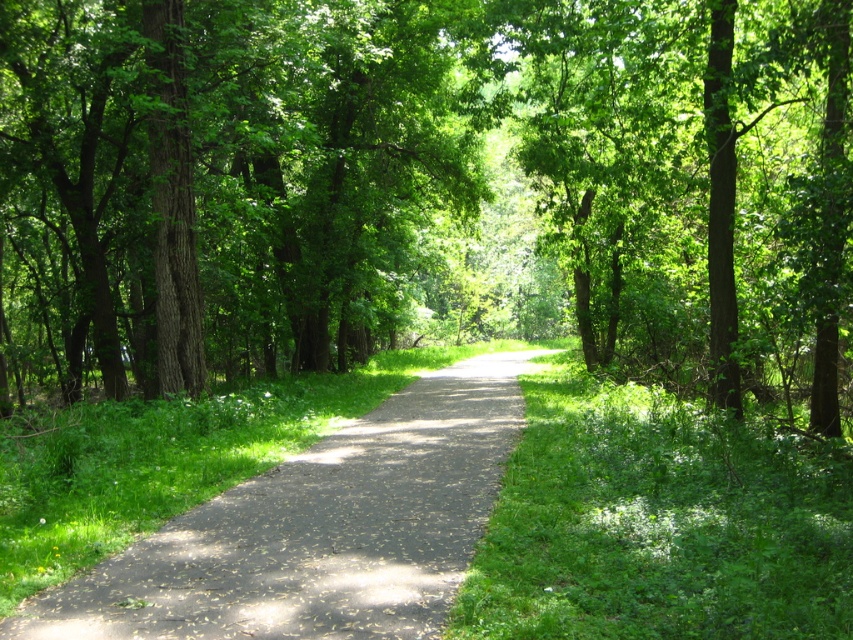
Question: Is green leafy tree at center thinner than dark gray asphalt path at center?

Choices:
 (A) no
 (B) yes

Answer: (A)

Question: Which object is closer to the camera taking this photo?

Choices:
 (A) dark gray asphalt path at center
 (B) green leafy tree at center

Answer: (A)

Question: Is green leafy tree at center wider than dark gray asphalt path at center?

Choices:
 (A) yes
 (B) no

Answer: (A)

Question: Is the position of green leafy tree at center less distant than that of dark gray asphalt path at center?

Choices:
 (A) no
 (B) yes

Answer: (A)